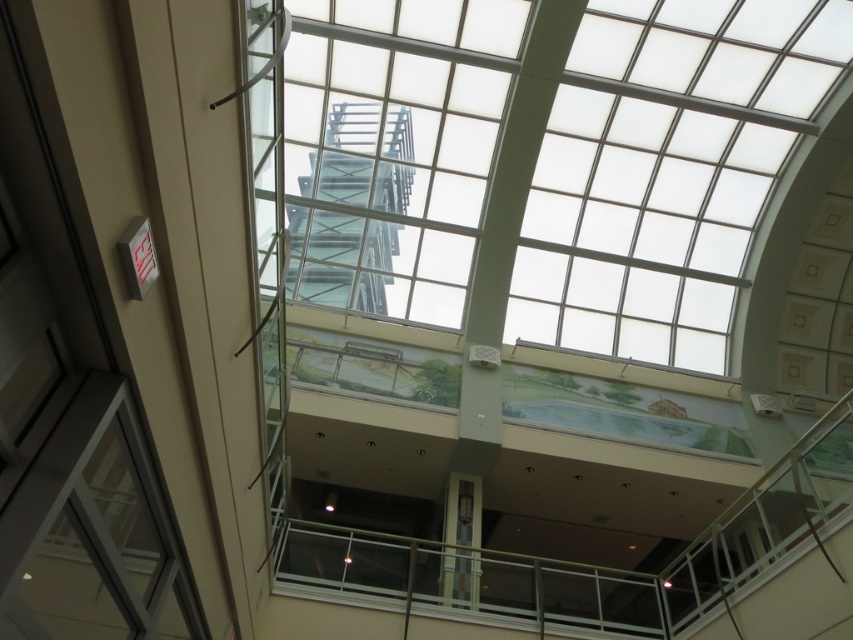
Question: Is clear glass window at lower left smaller than clear glass staircase at center?

Choices:
 (A) no
 (B) yes

Answer: (B)

Question: Is clear glass window at lower left in front of clear glass staircase at center?

Choices:
 (A) no
 (B) yes

Answer: (B)

Question: Can you confirm if clear glass window at lower left is thinner than clear glass staircase at center?

Choices:
 (A) no
 (B) yes

Answer: (B)